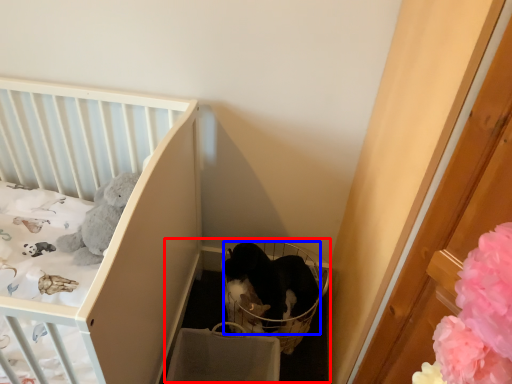
Question: Which point is further to the camera, baby carriage (highlighted by a red box) or cat (highlighted by a blue box)?

Choices:
 (A) baby carriage
 (B) cat

Answer: (B)